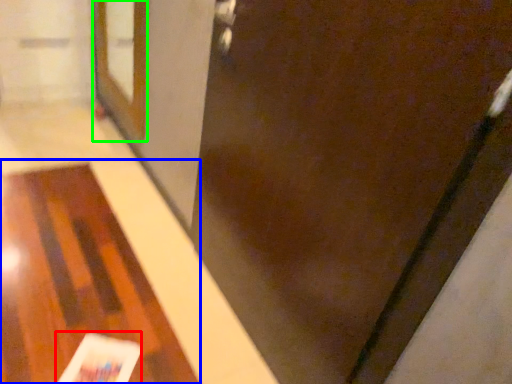
Question: Based on their relative distances, which object is farther from magazine (highlighted by a red box)? Choose from table (highlighted by a blue box) and screen door (highlighted by a green box).

Choices:
 (A) table
 (B) screen door

Answer: (B)